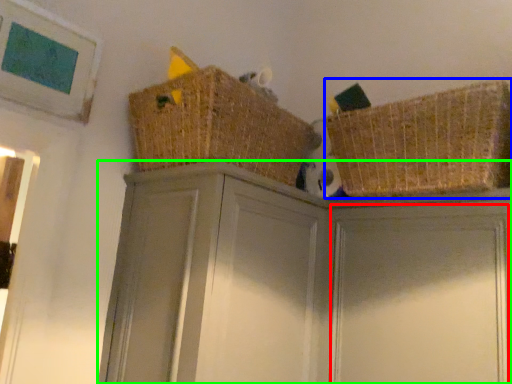
Question: Estimate the real-world distances between objects in this image. Which object is closer to door (highlighted by a red box), basket (highlighted by a blue box) or cabinetry (highlighted by a green box)?

Choices:
 (A) basket
 (B) cabinetry

Answer: (B)